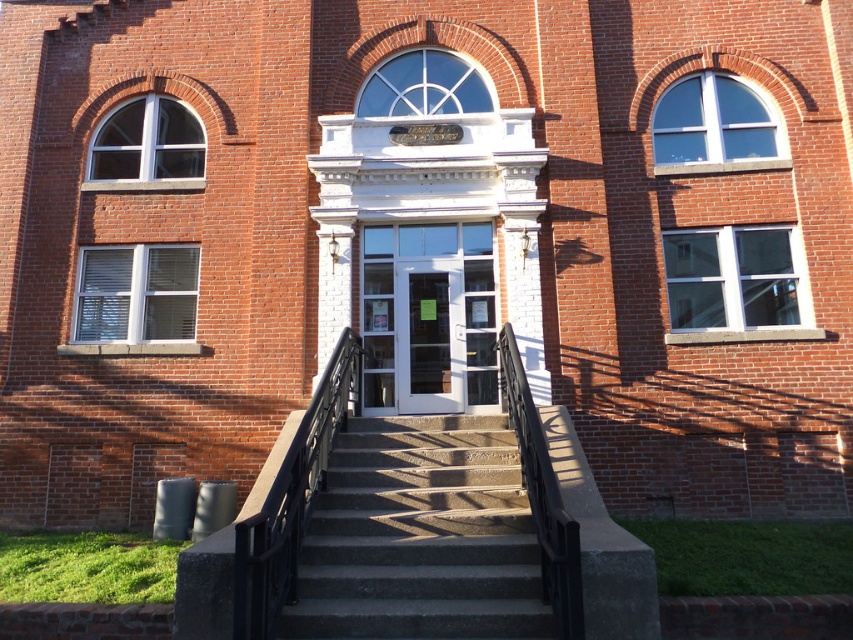
You are standing in front of the brick building and want to take a photo. You notice two points marked on the building. The first point is at coordinates point [482,538] and the second is at point [236,598]. Which point is closer to your camera lens?

Point [236,598] is closer to the camera lens because the description states that point [482,538] is further away than point [236,598].